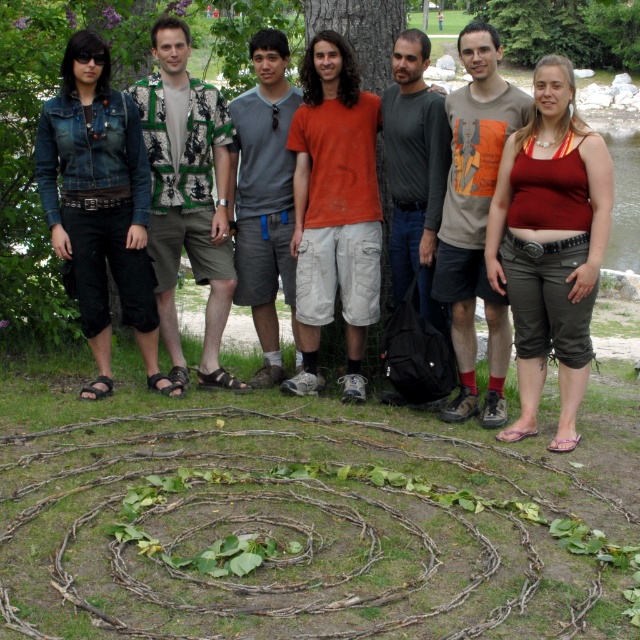
Question: Which object is farther from the camera taking this photo?

Choices:
 (A) denim jacket at left
 (B) gray cotton t-shirt at center
 (C) orange cotton t-shirt at center
 (D) printed cotton shirt at center

Answer: (B)

Question: Which object appears farthest from the camera in this image?

Choices:
 (A) denim jacket at left
 (B) matte red tank top at right
 (C) gray cotton t-shirt at center
 (D) orange cotton t-shirt at center

Answer: (C)

Question: Can you confirm if orange cotton t-shirt at center is thinner than gray cotton t-shirt at center?

Choices:
 (A) no
 (B) yes

Answer: (A)

Question: Is denim jacket at left bigger than gray cotton t-shirt at center?

Choices:
 (A) yes
 (B) no

Answer: (A)

Question: Which point is farther to the camera?

Choices:
 (A) (173, 221)
 (B) (243, 195)
 (C) (339, 56)
 (D) (566, 80)

Answer: (B)

Question: Is denim jacket at left bigger than printed cotton shirt at center?

Choices:
 (A) yes
 (B) no

Answer: (A)